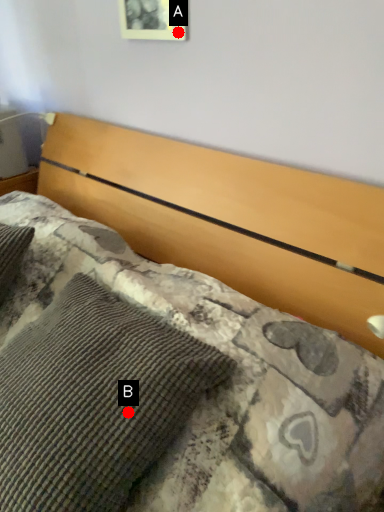
Question: Two points are circled on the image, labeled by A and B beside each circle. Which point appears closest to the camera in this image?

Choices:
 (A) A is closer
 (B) B is closer

Answer: (B)